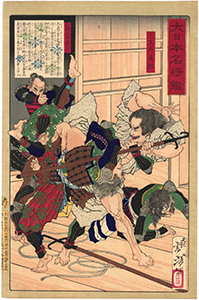
Locate an element on the screen. floor is located at coordinates (119, 270).